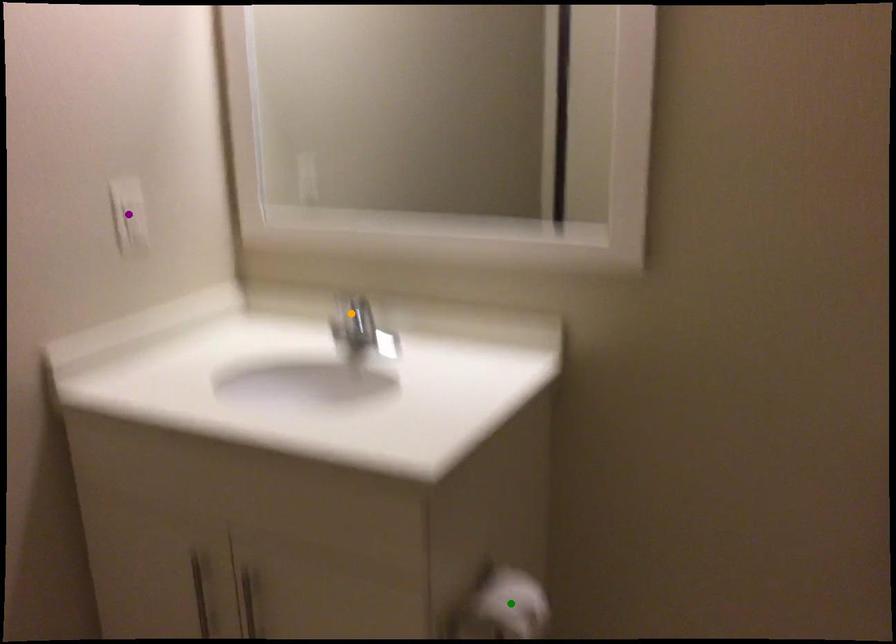
In the scene shown: Order these from nearest to farthest:
green point
purple point
orange point

green point < purple point < orange point